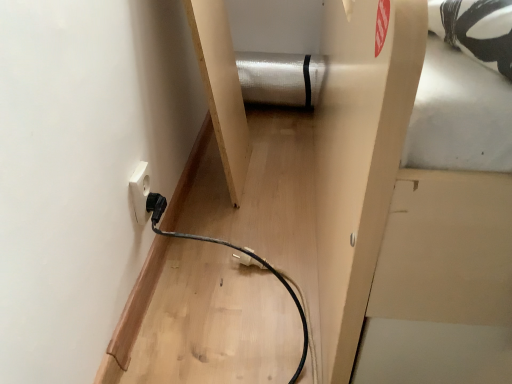
Image resolution: width=512 pixels, height=384 pixels. What do you see at coordinates (140, 192) in the screenshot?
I see `white plastic socket at lower left` at bounding box center [140, 192].

I want to click on white plastic socket at lower left, so click(x=140, y=192).

Image resolution: width=512 pixels, height=384 pixels. What are the coordinates of `white plastic socket at lower left` in the screenshot? It's located at (140, 192).